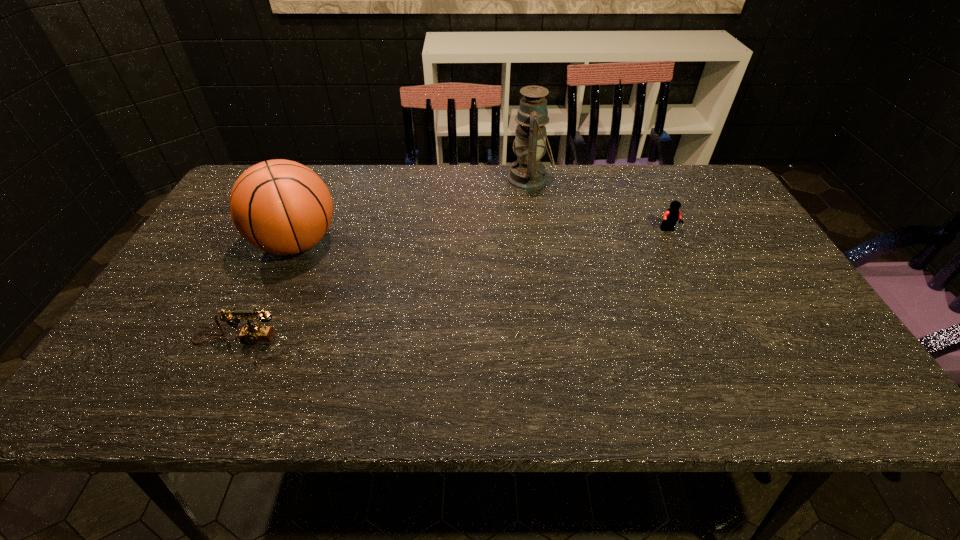
The image size is (960, 540). What are the coordinates of `the second object from right to left` in the screenshot? It's located at (527, 173).

In order to click on the farthest object in this screenshot , I will do (x=527, y=173).

Image resolution: width=960 pixels, height=540 pixels. In order to click on the third shortest object in this screenshot , I will do click(x=279, y=206).

Identify the location of the rightmost object. (670, 217).

The width and height of the screenshot is (960, 540). I want to click on telephone, so click(251, 333).

The image size is (960, 540). I want to click on vacant space located 0.220m on the right of the tallest object, so click(x=621, y=180).

Locate an element on the screen. The width and height of the screenshot is (960, 540). blank area located on the front of the second tallest object is located at coordinates (260, 325).

At what (x,y) coordinates should I click in order to perform the action: click on vacant space located on the front-facing side of the rightmost object. Please return your answer as a coordinate pair (x, y). The width and height of the screenshot is (960, 540). Looking at the image, I should click on (708, 315).

Where is `object present at the far edge`? The width and height of the screenshot is (960, 540). object present at the far edge is located at coordinates (527, 173).

Identify the location of basketball that is at the left edge. The height and width of the screenshot is (540, 960). (279, 206).